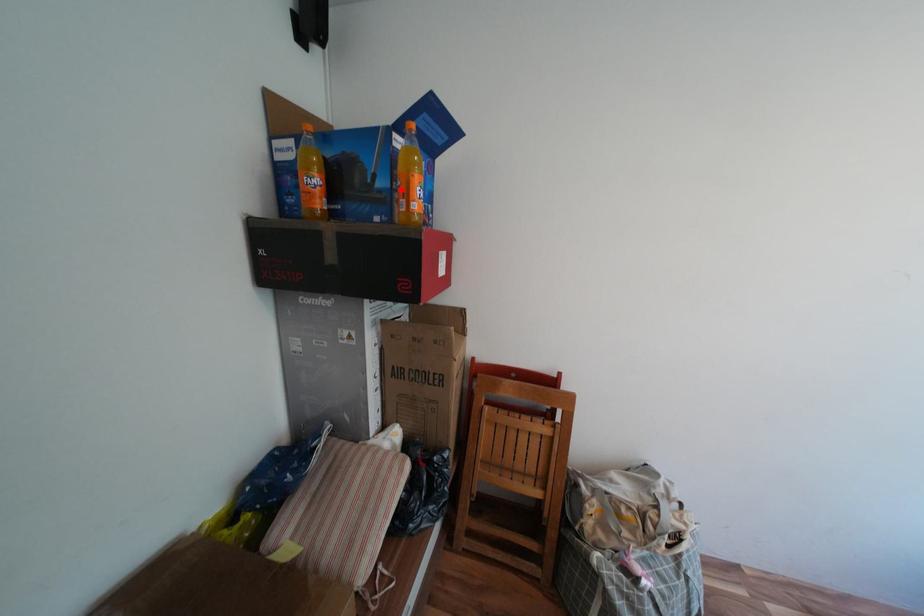
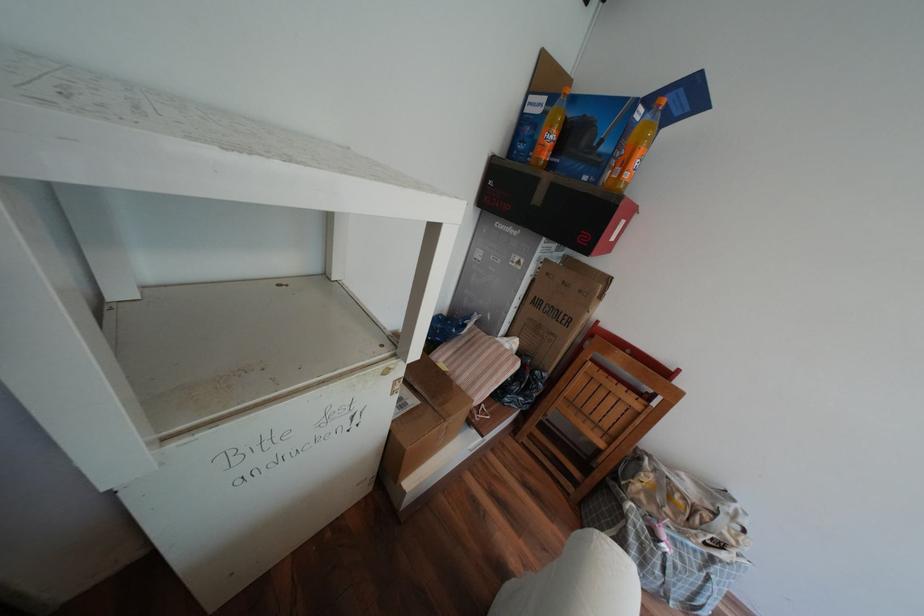
In the second image, find the point that corresponds to the highlighted location in the first image.

(621, 156)